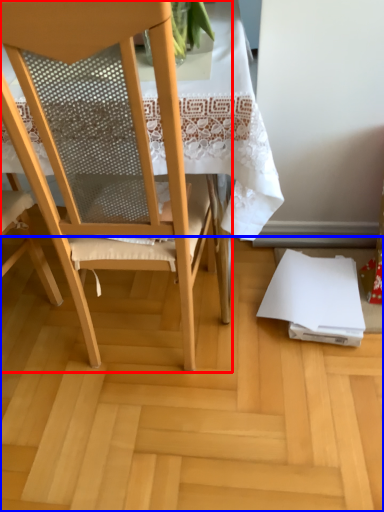
Question: Which of the following is the closest to the observer, chair (highlighted by a red box) or plywood (highlighted by a blue box)?

Choices:
 (A) chair
 (B) plywood

Answer: (A)